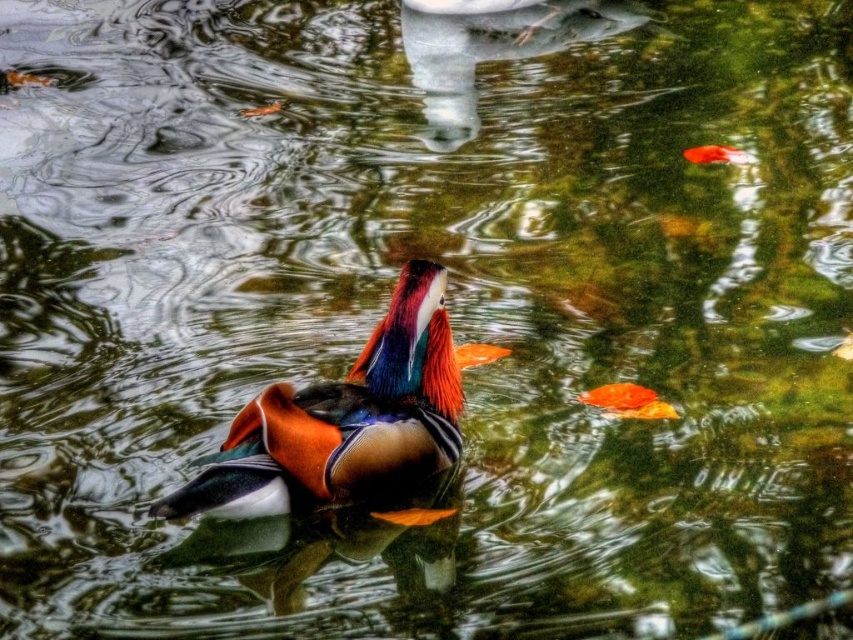
Question: Considering the relative positions of shiny orange fish at lower right and shiny orange fish at upper right in the image provided, where is shiny orange fish at lower right located with respect to shiny orange fish at upper right?

Choices:
 (A) right
 (B) left

Answer: (B)

Question: Which object is closer to the camera taking this photo?

Choices:
 (A) shiny multicolored duck at center
 (B) shiny orange fish at upper right

Answer: (A)

Question: Which point is farther to the camera?

Choices:
 (A) orange glossy goldfish at center
 (B) shiny multicolored duck at center
 (C) shiny orange fish at upper right
 (D) shiny orange fish at lower right

Answer: (C)

Question: Estimate the real-world distances between objects in this image. Which object is closer to the shiny orange fish at upper right?

Choices:
 (A) shiny multicolored duck at center
 (B) shiny orange fish at lower right

Answer: (B)

Question: Can you confirm if shiny orange fish at lower right is smaller than shiny orange fish at upper right?

Choices:
 (A) no
 (B) yes

Answer: (A)

Question: Is shiny orange fish at lower right positioned behind orange glossy goldfish at center?

Choices:
 (A) no
 (B) yes

Answer: (A)